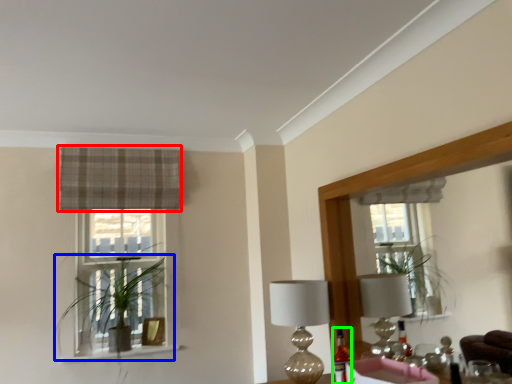
Question: Estimate the real-world distances between objects in this image. Which object is closer to curtain (highlighted by a red box), houseplant (highlighted by a blue box) or bottle (highlighted by a green box)?

Choices:
 (A) houseplant
 (B) bottle

Answer: (A)